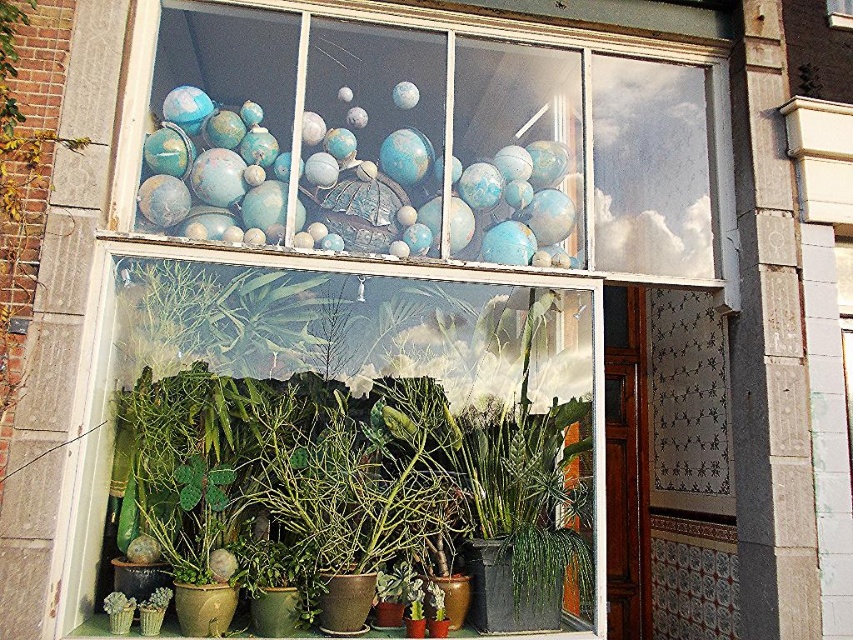
You are a delivery person who needs to place a new package in the storefront window. The package is 30 cm in height. The window has two existing items, the green matte plant at center and the blue matte globes at upper center. Which item can the package fit under without exceeding its height?

The package can fit under the green matte plant at center because it has a smaller size compared to the blue matte globes at upper center, so the green matte plant at center is shorter.

You are a delivery person who needs to place a 10 foot long package between the green matte plant at center and the globes in the upper portion. Is there enough space?

The distance between the green matte plant at center and the globes in the upper portion is 10.85 feet, so yes, the 10 foot long package can fit between them with some space to spare.

You are a window cleaner who needs to clean both the green matte plant at center and the blue matte globes at upper center. Which object requires you to use a taller ladder?

The green matte plant at center is taller than the blue matte globes at upper center, so you will need a taller ladder to reach the green matte plant at center.